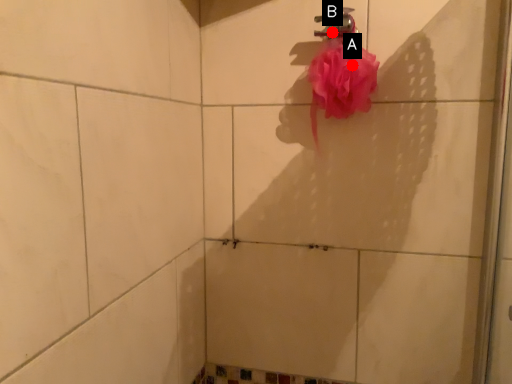
Question: Two points are circled on the image, labeled by A and B beside each circle. Which point is closer to the camera taking this photo?

Choices:
 (A) A is closer
 (B) B is closer

Answer: (A)